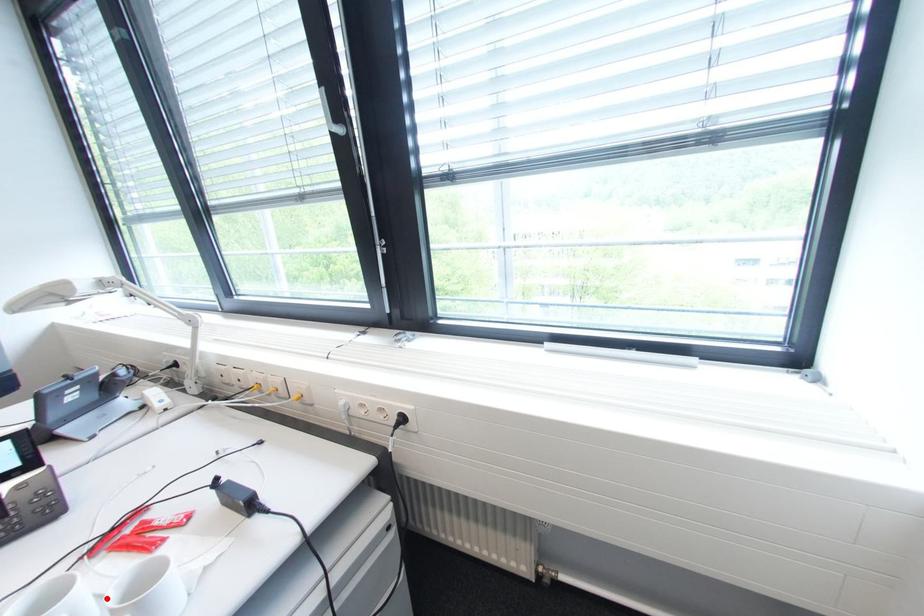
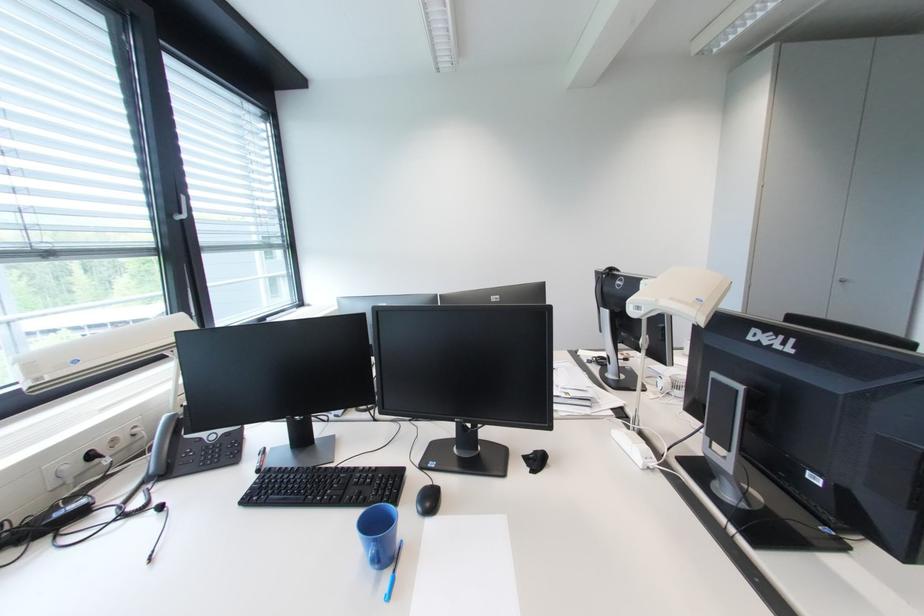
Question: I am providing you with two images of the same scene from different viewpoints. A red point is marked on the first image. Can you still see the location of the red point in image 2?

Choices:
 (A) Yes
 (B) No

Answer: (B)